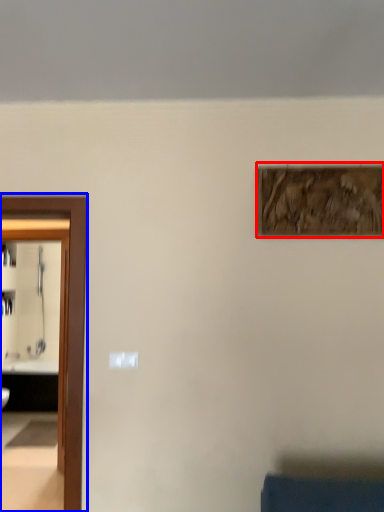
Question: Which of the following is the farthest to the observer, picture frame (highlighted by a red box) or elevator (highlighted by a blue box)?

Choices:
 (A) picture frame
 (B) elevator

Answer: (A)